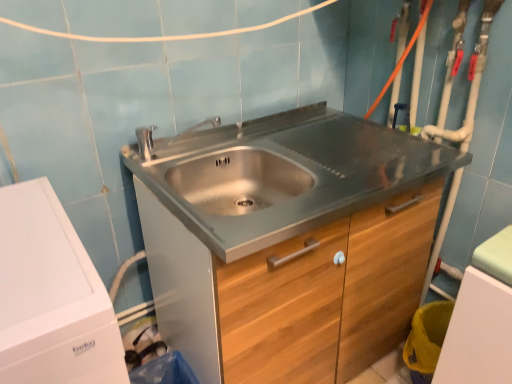
Where is `stainless steel cabinet at center`? The image size is (512, 384). stainless steel cabinet at center is located at coordinates (292, 293).

What is the approximate width of stainless steel cabinet at center?

The width of stainless steel cabinet at center is 63.28 centimeters.

What is the approximate height of stainless steel cabinet at center?

stainless steel cabinet at center is 32.09 inches in height.

The image size is (512, 384). Describe the element at coordinates (292, 293) in the screenshot. I see `stainless steel cabinet at center` at that location.

This screenshot has height=384, width=512. What do you see at coordinates (51, 296) in the screenshot?
I see `white matte washing machine at left` at bounding box center [51, 296].

What is the approximate width of white matte washing machine at left?

25.12 inches.

Where is `white matte washing machine at left`? The width and height of the screenshot is (512, 384). white matte washing machine at left is located at coordinates (51, 296).

Where is `stainless steel cabinet at center`? stainless steel cabinet at center is located at coordinates (292, 293).

Which is more to the left, white matte washing machine at left or stainless steel cabinet at center?

From the viewer's perspective, white matte washing machine at left appears more on the left side.

Does white matte washing machine at left come behind stainless steel cabinet at center?

No, white matte washing machine at left is in front of stainless steel cabinet at center.

Which is nearer, (59, 206) or (331, 301)?

Clearly, point (59, 206) is closer to the camera than point (331, 301).

From the image's perspective, who appears lower, white matte washing machine at left or stainless steel cabinet at center?

white matte washing machine at left is shown below in the image.

From a real-world perspective, does white matte washing machine at left stand above stainless steel cabinet at center?

Indeed, from a real-world perspective, white matte washing machine at left stands above stainless steel cabinet at center.

Looking at their sizes, would you say white matte washing machine at left is wider or thinner than stainless steel cabinet at center?

white matte washing machine at left is wider than stainless steel cabinet at center.

Is white matte washing machine at left taller than stainless steel cabinet at center?

Correct, white matte washing machine at left is much taller as stainless steel cabinet at center.

Is white matte washing machine at left bigger or smaller than stainless steel cabinet at center?

Clearly, white matte washing machine at left is smaller in size than stainless steel cabinet at center.

Consider the image. Would you say white matte washing machine at left is inside or outside stainless steel cabinet at center?

white matte washing machine at left is located beyond the bounds of stainless steel cabinet at center.

Consider the image. Is white matte washing machine at left not near stainless steel cabinet at center?

No, there isn't a large distance between white matte washing machine at left and stainless steel cabinet at center.

Is white matte washing machine at left aimed at stainless steel cabinet at center?

No, white matte washing machine at left is not turned towards stainless steel cabinet at center.

You are a GUI agent. You are given a task and a screenshot of the screen. Output one action in this format:
    pyautogui.click(x=<x>, y=<y>)
    Task: Click on the washing machine lying on the left of stainless steel cabinet at center
    This screenshot has width=512, height=384.
    Given the screenshot: What is the action you would take?
    pyautogui.click(x=51, y=296)

Looking at this image, between stainless steel cabinet at center and white matte washing machine at left, which one appears on the left side from the viewer's perspective?

white matte washing machine at left is more to the left.

Looking at this image, relative to white matte washing machine at left, is stainless steel cabinet at center in front or behind?

stainless steel cabinet at center is behind white matte washing machine at left.

Is point (228, 357) closer or farther from the camera than point (63, 295)?

Clearly, point (228, 357) is more distant from the camera than point (63, 295).

From the image's perspective, is stainless steel cabinet at center below white matte washing machine at left?

No.

From a real-world perspective, is stainless steel cabinet at center on top of white matte washing machine at left?

No, from a real-world perspective, stainless steel cabinet at center is not on top of white matte washing machine at left.

Which of these two, stainless steel cabinet at center or white matte washing machine at left, is thinner?

With smaller width is stainless steel cabinet at center.

Which of these two, stainless steel cabinet at center or white matte washing machine at left, stands shorter?

stainless steel cabinet at center is shorter.

Is stainless steel cabinet at center bigger than white matte washing machine at left?

Correct, stainless steel cabinet at center is larger in size than white matte washing machine at left.

Is stainless steel cabinet at center spatially inside white matte washing machine at left, or outside of it?

stainless steel cabinet at center lies outside white matte washing machine at left.

Would you consider stainless steel cabinet at center to be distant from white matte washing machine at left?

Actually, stainless steel cabinet at center and white matte washing machine at left are a little close together.

Does stainless steel cabinet at center turn towards white matte washing machine at left?

No, stainless steel cabinet at center is not facing towards white matte washing machine at left.

What's the angular difference between stainless steel cabinet at center and white matte washing machine at left's facing directions?

There is a 1.59-degree angle between the facing directions of stainless steel cabinet at center and white matte washing machine at left.

Where is `cabinetry behind the white matte washing machine at left`? The height and width of the screenshot is (384, 512). cabinetry behind the white matte washing machine at left is located at coordinates (292, 293).

Image resolution: width=512 pixels, height=384 pixels. I want to click on washing machine above the stainless steel cabinet at center (from a real-world perspective), so click(x=51, y=296).

Where is `cabinetry behind the white matte washing machine at left`? cabinetry behind the white matte washing machine at left is located at coordinates (292, 293).